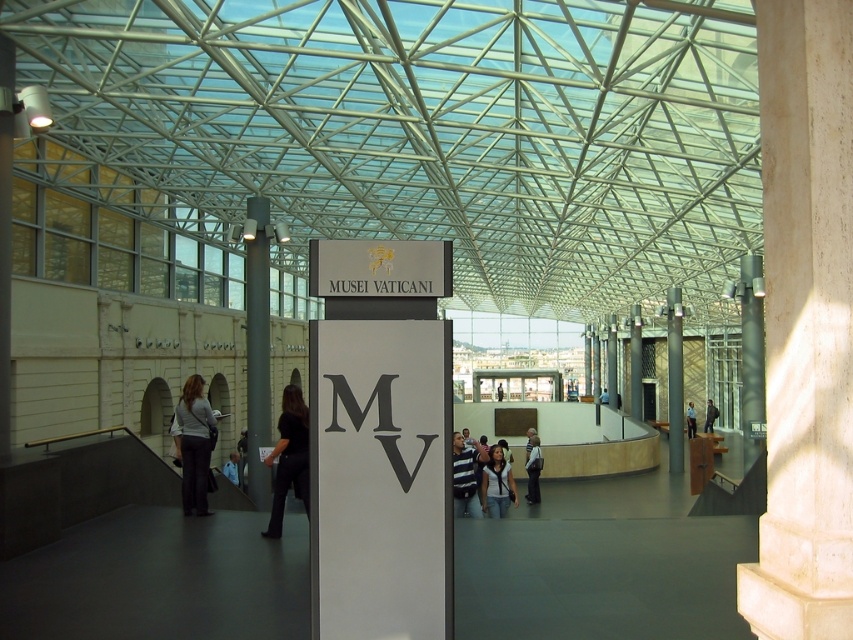
Question: In this image, where is light blue uniform at center located relative to dark blue shirt at center?

Choices:
 (A) left
 (B) right

Answer: (A)

Question: Where is dark gray jacket at right located in relation to dark blue shirt at center in the image?

Choices:
 (A) right
 (B) left

Answer: (A)

Question: Which is farther from the satin silver column at left?

Choices:
 (A) white marble pillar at center
 (B) light blue uniform at center

Answer: (A)

Question: Which point appears farthest from the camera in this image?

Choices:
 (A) pyautogui.click(x=489, y=496)
 (B) pyautogui.click(x=680, y=371)

Answer: (B)

Question: Estimate the real-world distances between objects in this image. Which object is farther from the matte gray pants at lower left?

Choices:
 (A) smooth stone pillar at center
 (B) white marble pillar at center
 (C) blue uniform at center

Answer: (B)

Question: Can you confirm if black fabric pants at center is smaller than light blue jeans at center?

Choices:
 (A) no
 (B) yes

Answer: (B)